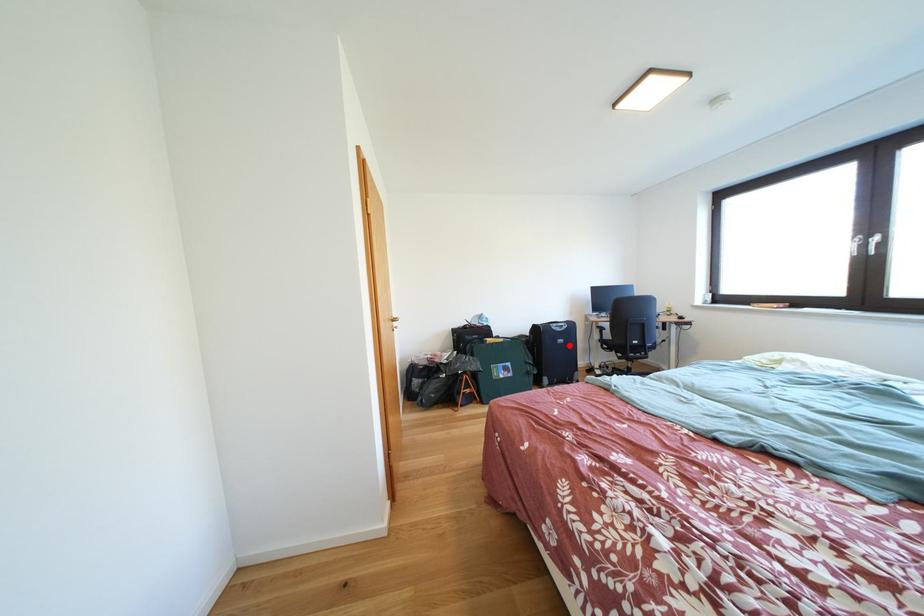
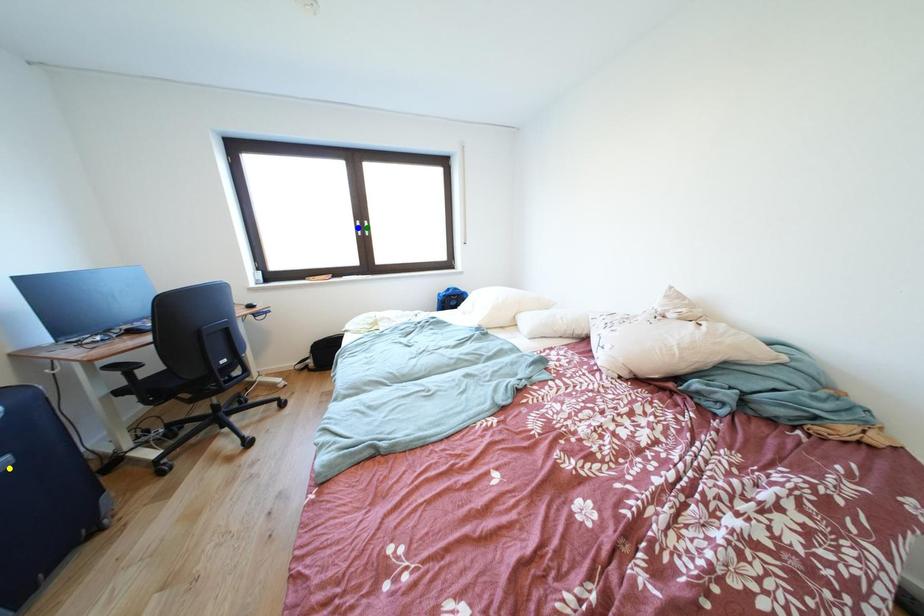
Question: I am providing you with two images of the same scene from different viewpoints. A red point is marked on the first image. You are given multiple points on the second image. Which spot in image 2 lines up with the point in image 1?

Choices:
 (A) blue point
 (B) yellow point
 (C) green point

Answer: (B)